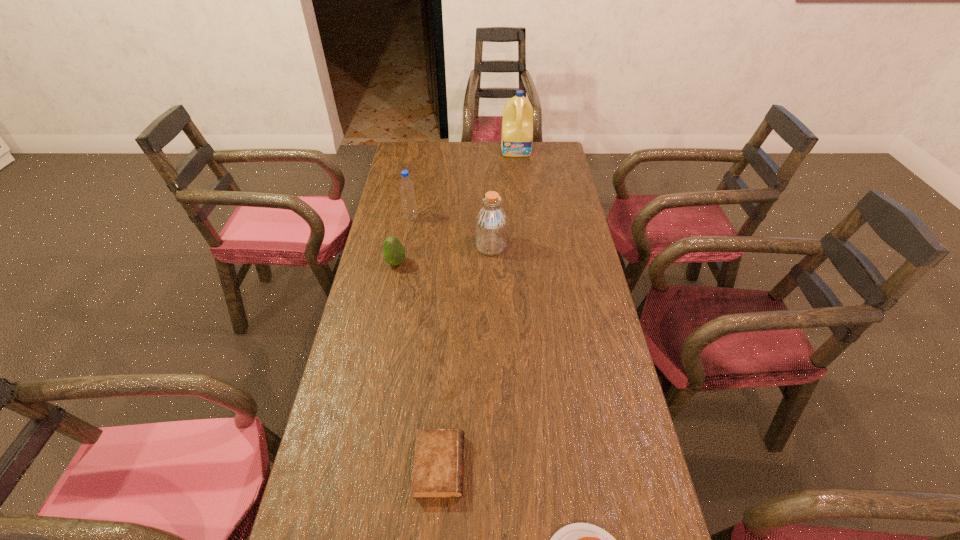
What are the coordinates of `unoccupied area between the water bottle and the avocado` in the screenshot? It's located at (403, 240).

I want to click on free area in between the tallest object and the fifth farthest object, so click(478, 308).

Find the location of a particular element. This screenshot has height=540, width=960. free area in between the second farthest object and the diary is located at coordinates (425, 342).

At what (x,y) coordinates should I click in order to perform the action: click on vacant space that's between the water bottle and the avocado. Please return your answer as a coordinate pair (x, y). Looking at the image, I should click on (403, 240).

Locate an element on the screen. The width and height of the screenshot is (960, 540). unoccupied area between the diary and the tallest object is located at coordinates (478, 308).

Where is `free spot between the tallest object and the avocado`? The height and width of the screenshot is (540, 960). free spot between the tallest object and the avocado is located at coordinates 456,207.

You are a GUI agent. You are given a task and a screenshot of the screen. Output one action in this format:
    pyautogui.click(x=<x>, y=<y>)
    Task: Click on the vacant point located between the fourth object from left to right and the third shortest object
    The image size is (960, 540).
    Given the screenshot: What is the action you would take?
    pyautogui.click(x=444, y=255)

Find the location of `free area in between the fourth tallest object and the fifth nearest object`. free area in between the fourth tallest object and the fifth nearest object is located at coordinates (403, 240).

In order to click on free spot between the third object from left to right and the fourth tallest object in this screenshot , I will do `click(418, 364)`.

Find the location of a particular element. This screenshot has width=960, height=540. blank region between the fifth nearest object and the fifth farthest object is located at coordinates (425, 342).